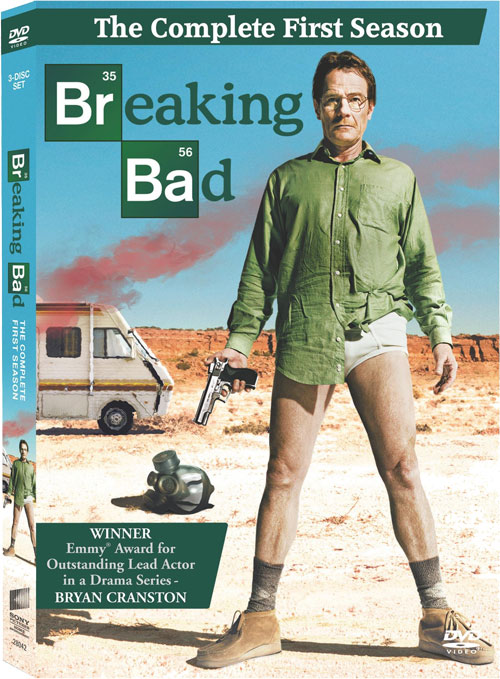
Find the location of a particular element. This screenshot has height=679, width=500. 2 underwears is located at coordinates (389, 333), (28, 500).